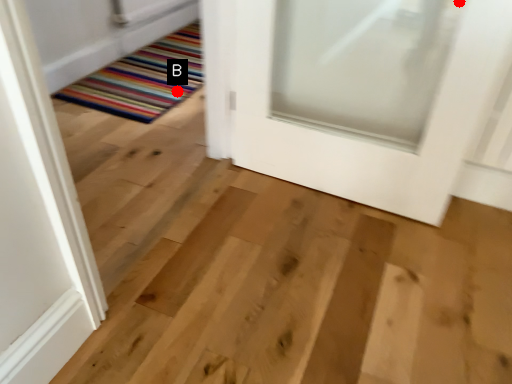
Question: Two points are circled on the image, labeled by A and B beside each circle. Which of the following is the closest to the observer?

Choices:
 (A) A is closer
 (B) B is closer

Answer: (A)